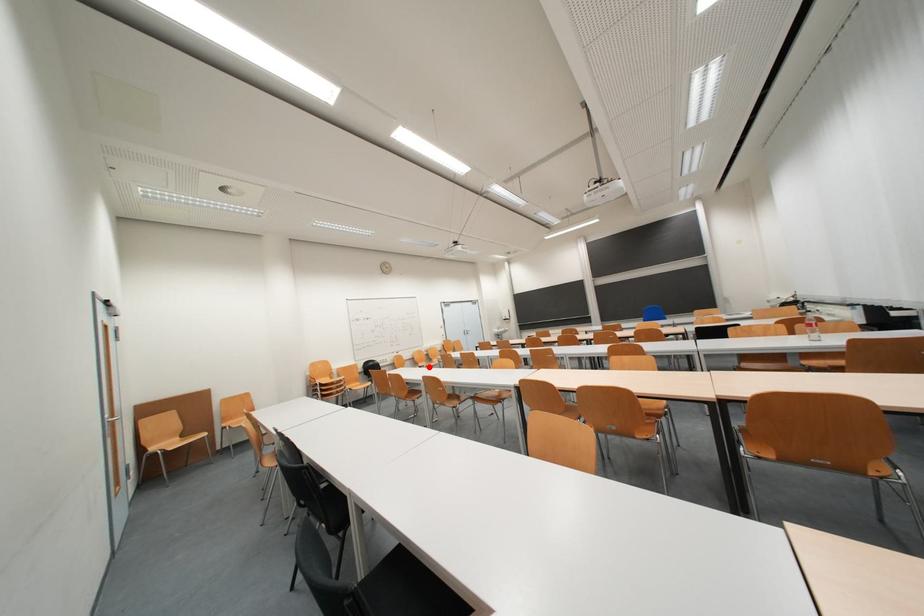
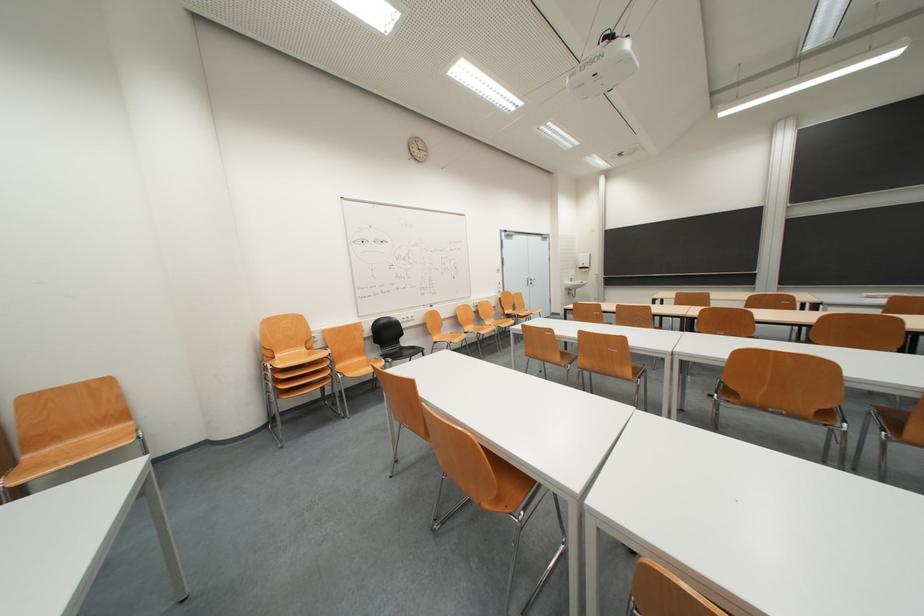
Question: I am providing you with two images of the same scene from different viewpoints. Image1 has a red point marked. In image2, the corresponding 3D location appears at what relative position? Reply with the corresponding letter.

Choices:
 (A) Closer
 (B) Farther

Answer: (A)